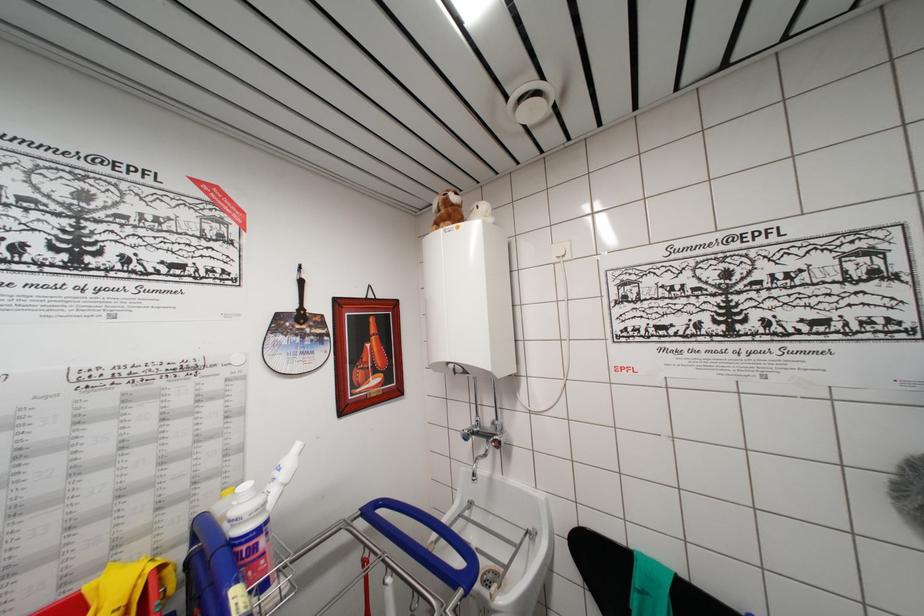
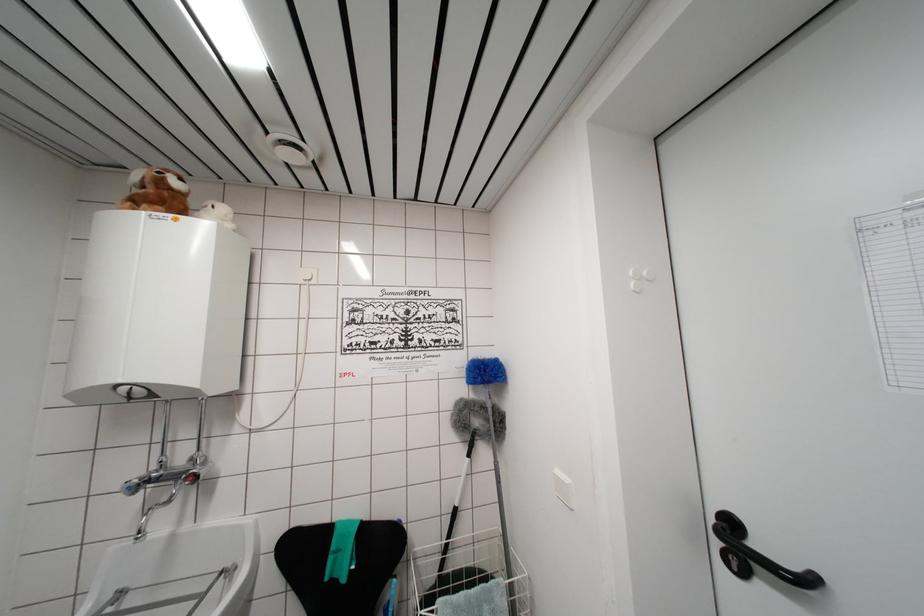
The point at (x=521, y=546) is marked in the first image. Where is the corresponding point in the second image?

(209, 593)